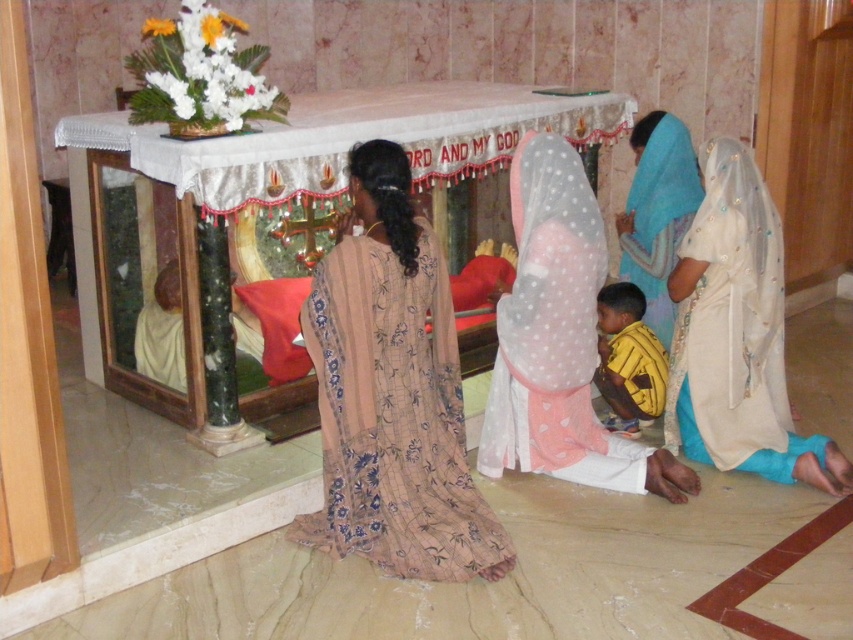
You are a photographer standing in front of the shrine. You want to take a picture of the beige satin robe at lower right without moving any objects. Can you capture the robe clearly in your photo if your camera has a maximum focus range of 3 meters?

The beige satin robe at lower right is 3.67 meters away from the viewer. Since the camera can only focus up to 3 meters, it cannot capture the robe clearly at this distance.

You are standing in front of the shrine and notice a point marked at coordinates (392, 394). Based on the scene description, what object or feature is located at this point?

The point at coordinates (392, 394) corresponds to the beige floral dress at center.

You are standing in front of the shrine and want to take a photo. There are two points marked on the floor at coordinates point [695,244] and point [660,250]. Which point is closer to you so that it appears larger in your photo?

Point [695,244] is closer to the camera than point [660,250], so it will appear larger in the photo.